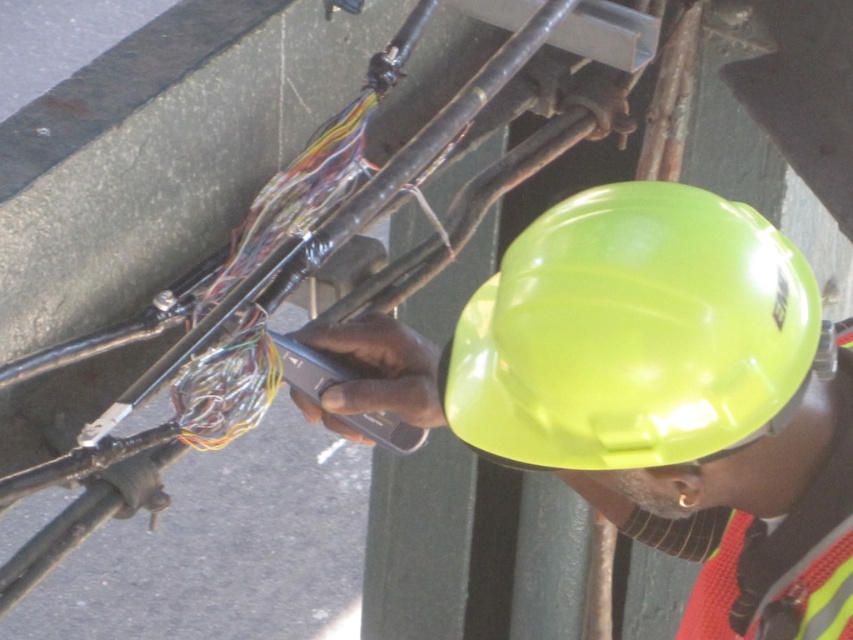
You are a safety inspector checking the equipment of a worker. You notice two hard hats at center. Which one is closer to you, the neon yellow hard hat at center or the glossy hard hat at center?

The neon yellow hard hat at center is closer to you because the glossy hard hat at center is behind it.

You are a safety inspector reviewing the image. The neon yellow hard hat at center must be positioned at point 0.5 according to safety regulations. Is the current position compliant?

The neon yellow hard hat at center is located at point 0.595, which is beyond the 0.5 requirement, so it does not comply with safety regulations.